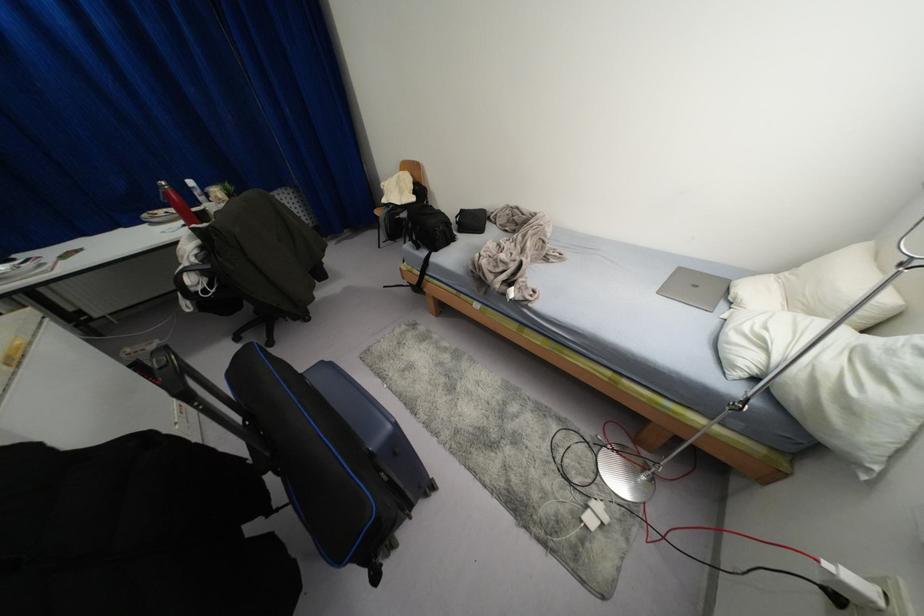
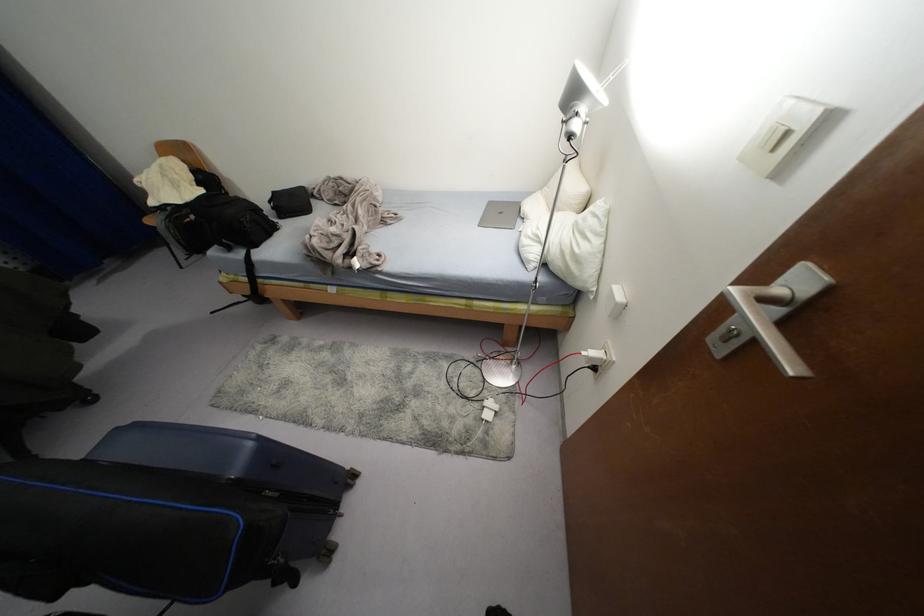
Where in the second image is the point corresponding to pixel 695 286 from the first image?

(500, 213)